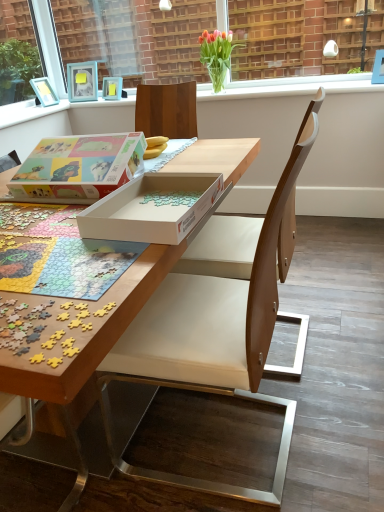
Where is `vacant area located to the right-hand side of wooden chair at center`? vacant area located to the right-hand side of wooden chair at center is located at coordinates (337, 408).